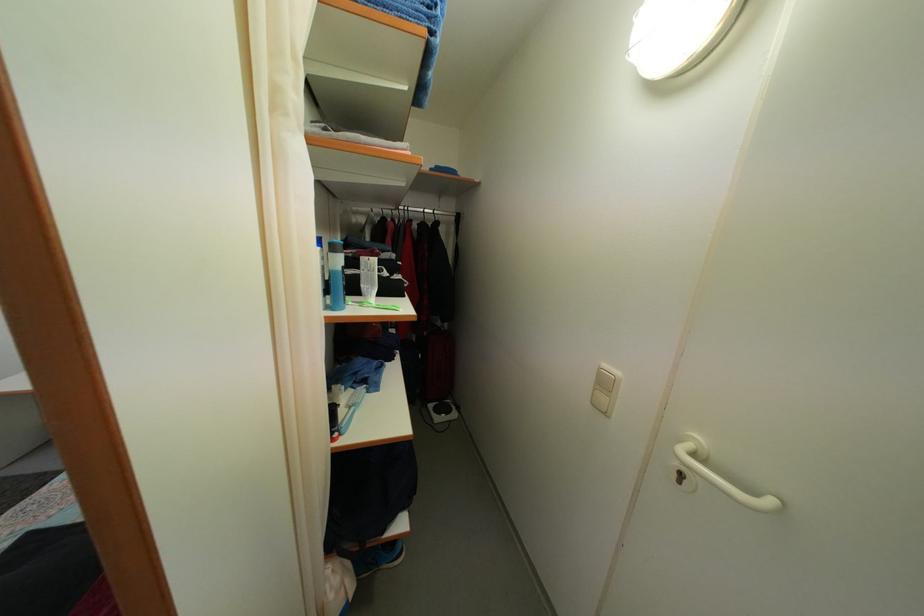
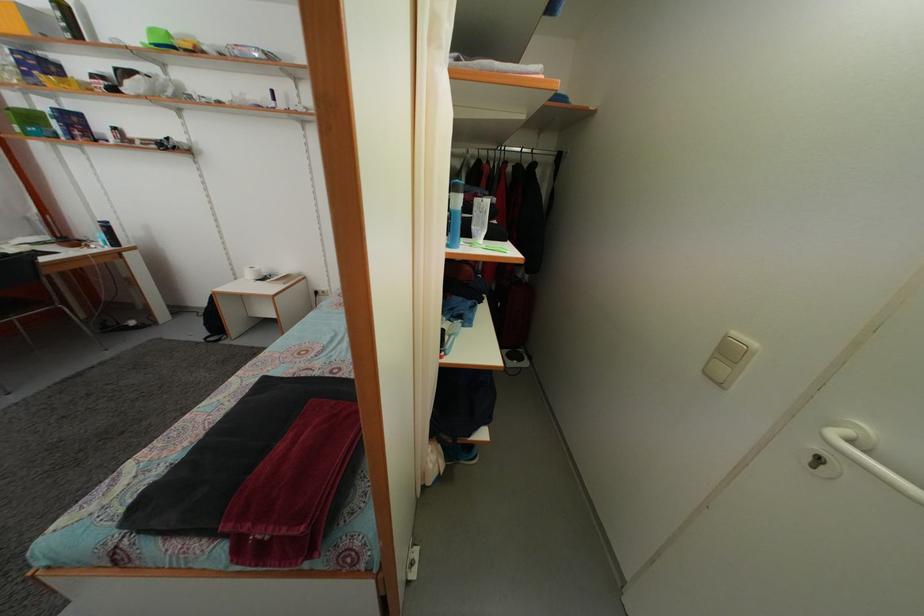
Question: How did the camera likely rotate?

Choices:
 (A) Left
 (B) Right
 (C) Up
 (D) Down

Answer: (A)